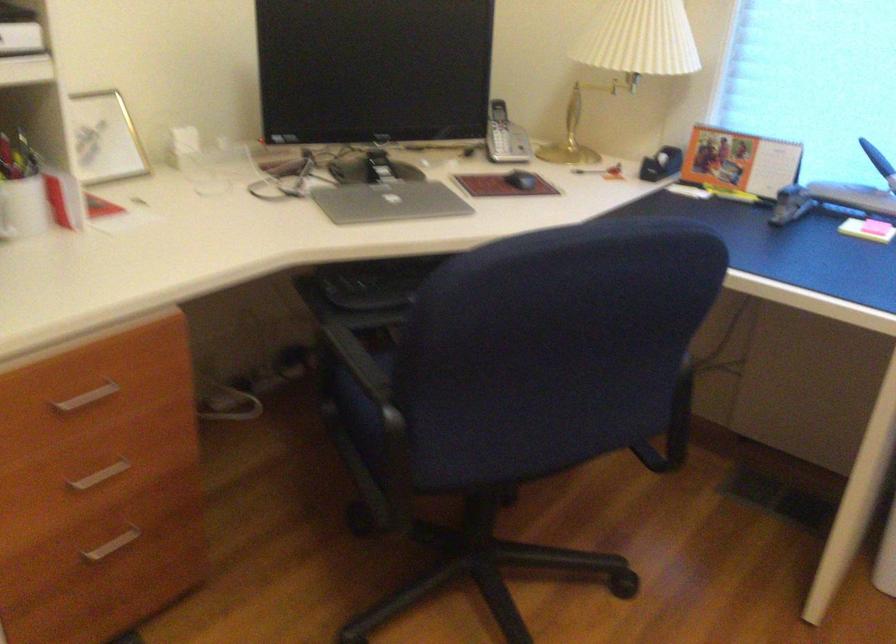
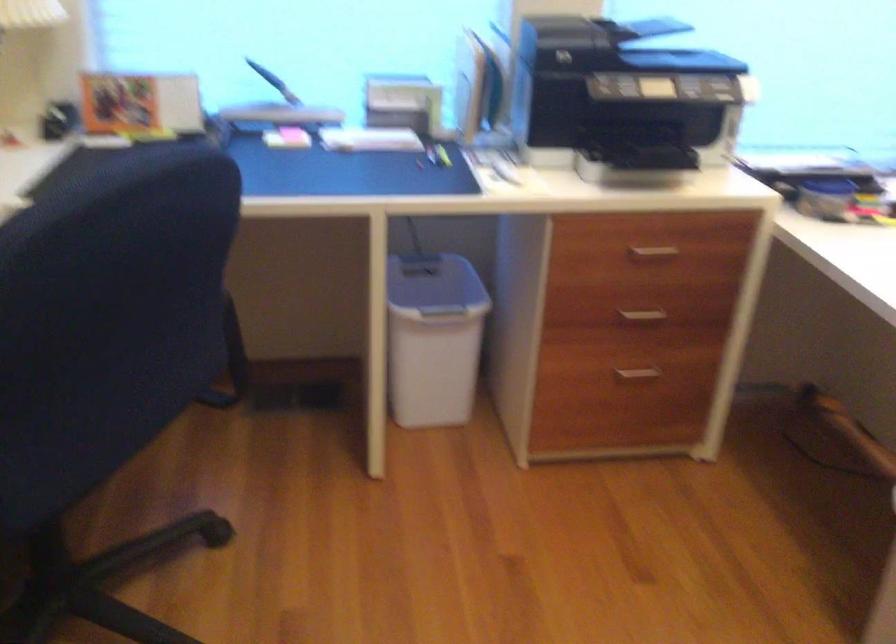
Question: How did the camera likely rotate?

Choices:
 (A) Left
 (B) Right
 (C) Up
 (D) Down

Answer: (B)